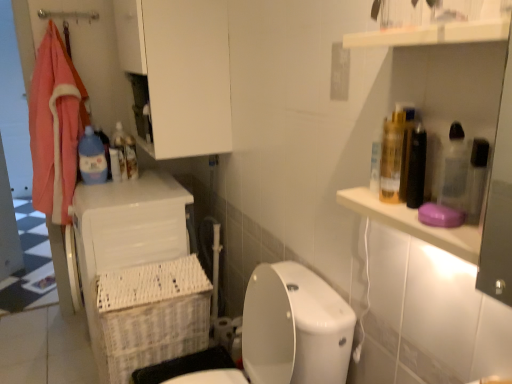
The image size is (512, 384). Find the location of `vacant point to the right of blue plastic bottle at left`. vacant point to the right of blue plastic bottle at left is located at coordinates (125, 180).